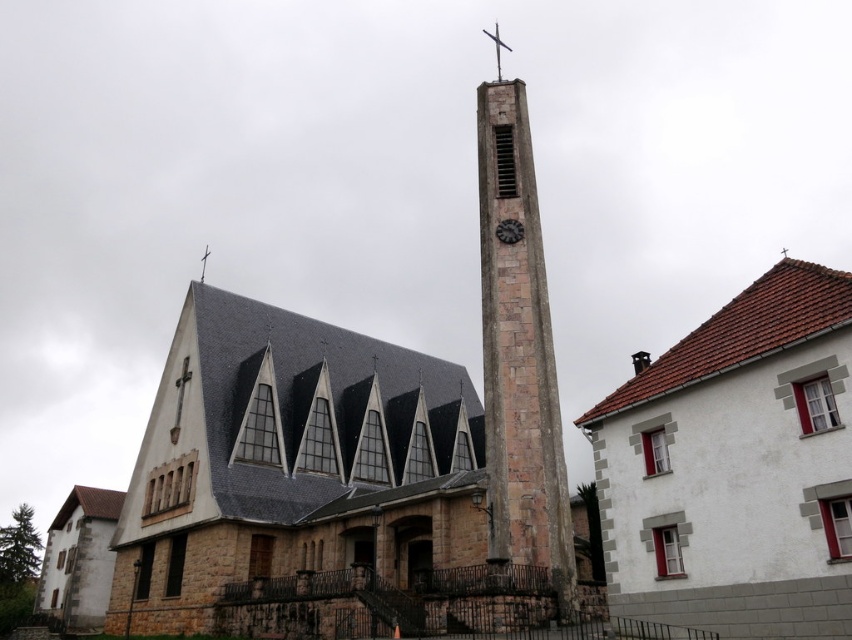
Which is in front, point (527, 234) or point (499, 221)?

Positioned in front is point (527, 234).

Is rustic stone clock tower at center to the right of dark brown textured clock at center from the viewer's perspective?

Incorrect, rustic stone clock tower at center is not on the right side of dark brown textured clock at center.

Describe the element at coordinates (519, 355) in the screenshot. The height and width of the screenshot is (640, 852). I see `rustic stone clock tower at center` at that location.

Where is `rustic stone clock tower at center`? rustic stone clock tower at center is located at coordinates (519, 355).

Does white stone house at right have a larger size compared to rustic stone clock tower at center?

No.

This screenshot has height=640, width=852. Describe the element at coordinates (735, 467) in the screenshot. I see `white stone house at right` at that location.

The width and height of the screenshot is (852, 640). Describe the element at coordinates (735, 467) in the screenshot. I see `white stone house at right` at that location.

The image size is (852, 640). Find the location of `white stone house at right`. white stone house at right is located at coordinates (735, 467).

Can you confirm if white stone house at right is wider than rustic stone spire at center?

No.

Describe the element at coordinates (735, 467) in the screenshot. This screenshot has width=852, height=640. I see `white stone house at right` at that location.

Image resolution: width=852 pixels, height=640 pixels. I want to click on white stone house at right, so click(x=735, y=467).